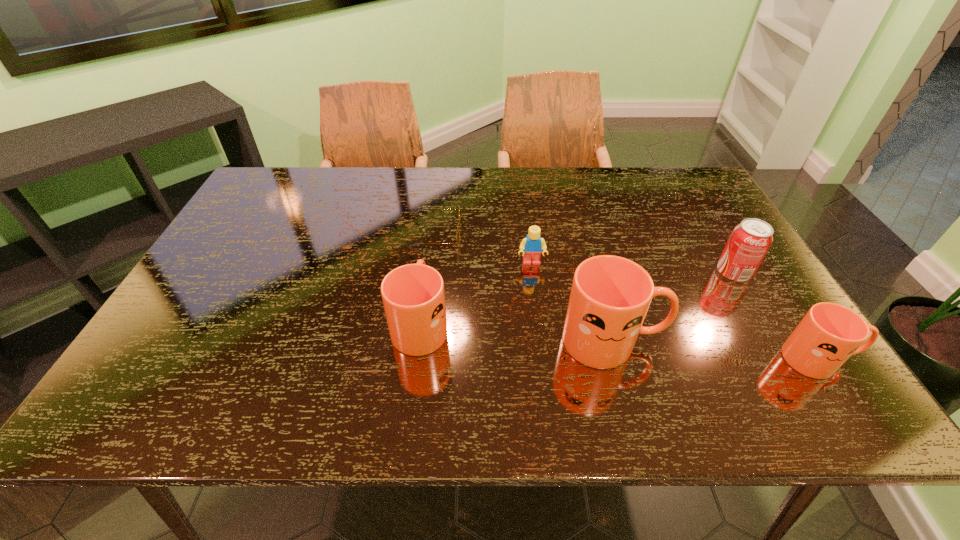
With all mugs evenly spaced, where should an extra mug be placed on the left to continue the pattern? Please point out a vacant space. Please provide its 2D coordinates. Your answer should be formatted as a tuple, i.e. [(x, y)], where the tuple contains the x and y coordinates of a point satisfying the conditions above.

[(242, 308)]